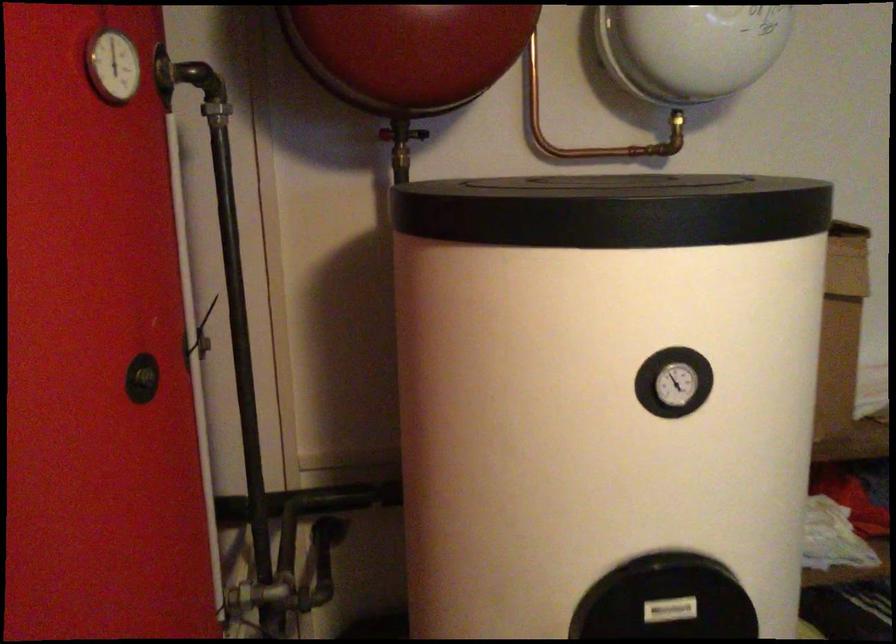
What do you see at coordinates (666, 601) in the screenshot? I see `the black access cover` at bounding box center [666, 601].